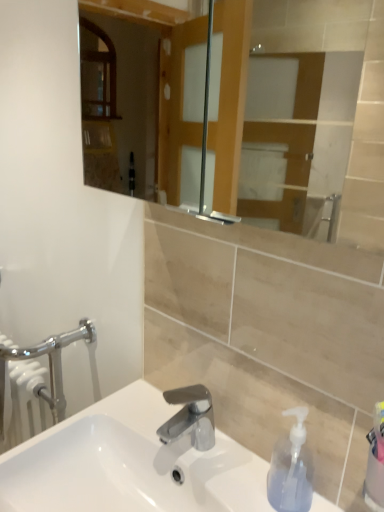
Question: Is chrome metallic faucet at center turned away from white glossy sink at center?

Choices:
 (A) yes
 (B) no

Answer: (B)

Question: Does chrome metallic faucet at center have a larger size compared to white glossy sink at center?

Choices:
 (A) no
 (B) yes

Answer: (A)

Question: Is chrome metallic faucet at center not within white glossy sink at center?

Choices:
 (A) no
 (B) yes

Answer: (B)

Question: Is white glossy sink at center surrounded by chrome metallic faucet at center?

Choices:
 (A) no
 (B) yes

Answer: (A)

Question: Is chrome metallic faucet at center at the left side of white glossy sink at center?

Choices:
 (A) yes
 (B) no

Answer: (B)

Question: Can you confirm if chrome metallic faucet at center is wider than white glossy sink at center?

Choices:
 (A) no
 (B) yes

Answer: (A)

Question: Could you tell me if chrome metallic faucet at center is facing transparent plastic soap dispenser at lower right?

Choices:
 (A) yes
 (B) no

Answer: (B)

Question: Is chrome metallic faucet at center positioned behind transparent plastic soap dispenser at lower right?

Choices:
 (A) yes
 (B) no

Answer: (A)

Question: Are chrome metallic faucet at center and transparent plastic soap dispenser at lower right beside each other?

Choices:
 (A) yes
 (B) no

Answer: (B)

Question: Is chrome metallic faucet at center wider than transparent plastic soap dispenser at lower right?

Choices:
 (A) yes
 (B) no

Answer: (A)

Question: Is chrome metallic faucet at center positioned far away from transparent plastic soap dispenser at lower right?

Choices:
 (A) no
 (B) yes

Answer: (A)

Question: Can you confirm if chrome metallic faucet at center is positioned to the left of transparent plastic soap dispenser at lower right?

Choices:
 (A) yes
 (B) no

Answer: (A)

Question: Does transparent plastic soap dispenser at lower right come in front of white glossy sink at center?

Choices:
 (A) no
 (B) yes

Answer: (A)